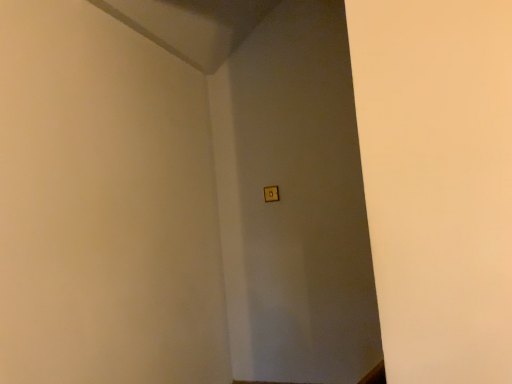
I want to click on matte gold light switch at center, so click(271, 194).

What do you see at coordinates (271, 194) in the screenshot? I see `matte gold light switch at center` at bounding box center [271, 194].

Locate an element on the screen. matte gold light switch at center is located at coordinates (271, 194).